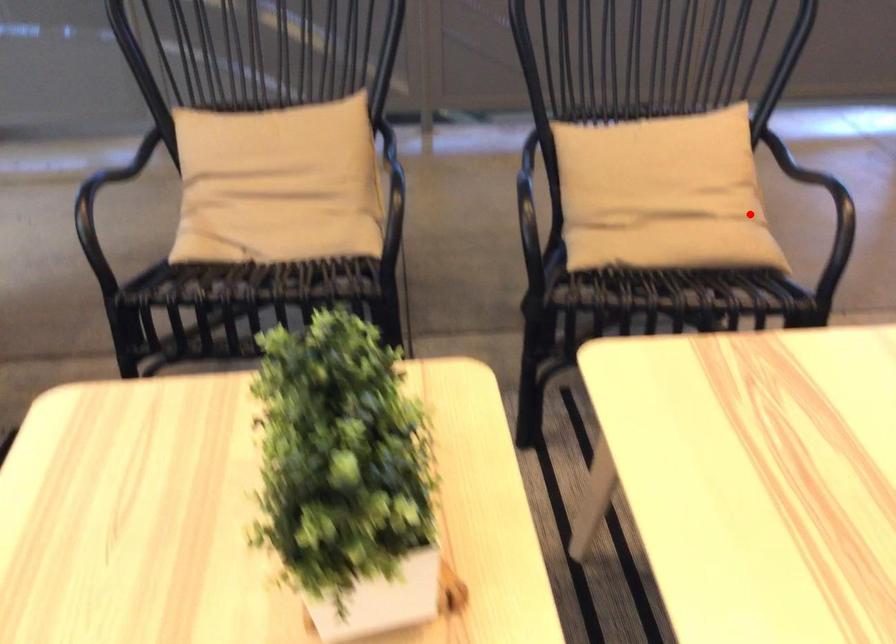
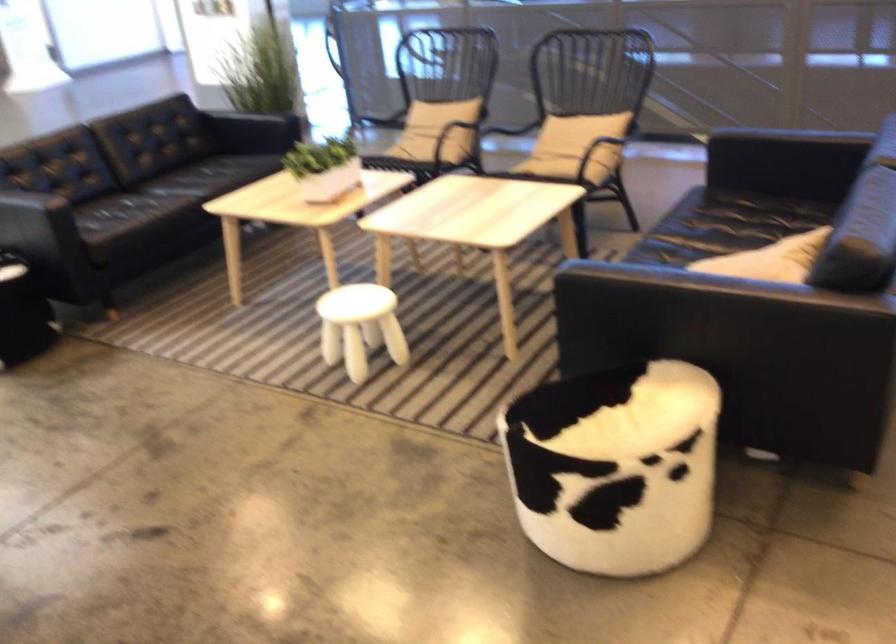
Where in the second image is the point corresponding to the highlighted location from the first image?

(574, 147)